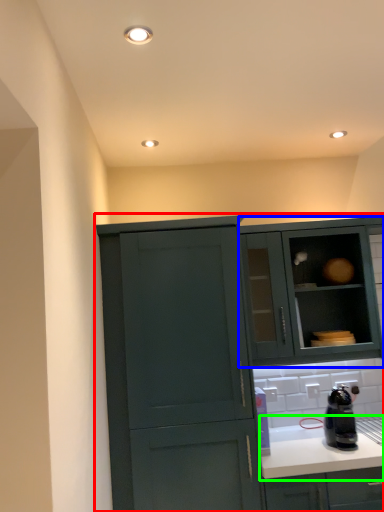
Question: Estimate the real-world distances between objects in this image. Which object is farther from cabinetry (highlighted by a red box), cabinetry (highlighted by a blue box) or countertop (highlighted by a green box)?

Choices:
 (A) cabinetry
 (B) countertop

Answer: (A)